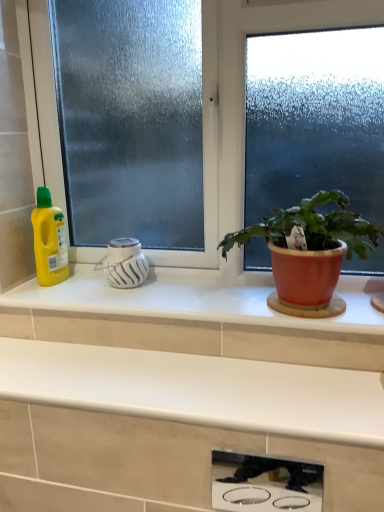
You are a GUI agent. You are given a task and a screenshot of the screen. Output one action in this format:
    pyautogui.click(x=<x>, y=<y>)
    Task: Click on the vacant space situated on the left part of white matte diffuser at center, which is the 1th appliance from back to front
    This screenshot has height=512, width=384.
    Given the screenshot: What is the action you would take?
    pyautogui.click(x=63, y=290)